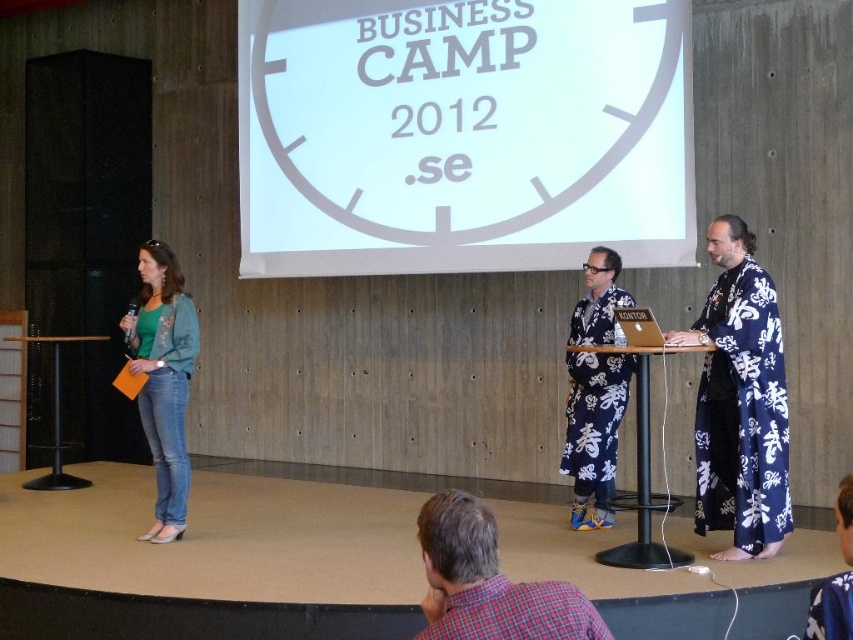
What are the coordinates of the white paper at upper center in the image?

The white paper at upper center is located at coordinates point (462, 134).

You are organizing a photo shoot and need to position two models wearing the blue printed kimono at right and the blue floral robe at center. The minimum distance required between them for the camera setup is 6 feet. Based on the scene description, will the current spacing between them suffice?

The blue printed kimono at right and blue floral robe at center are 6.35 feet apart, which exceeds the minimum required distance of 6 feet. Therefore, the current spacing between them is sufficient for the camera setup.